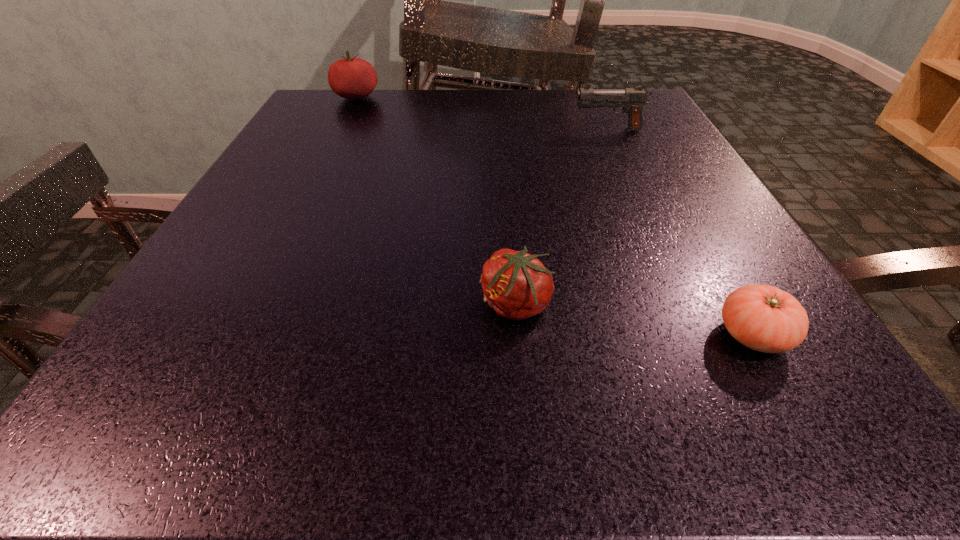
The height and width of the screenshot is (540, 960). Identify the location of vacant point at the far edge. (392, 123).

The image size is (960, 540). In the image, there is a desktop. In order to click on vacant space at the near edge in this screenshot , I will do `click(556, 411)`.

Identify the location of vacant space at the left edge of the desktop. (247, 194).

Identify the location of free space at the right edge. This screenshot has height=540, width=960. (683, 239).

Locate an element on the screen. free space at the far left corner of the desktop is located at coordinates click(x=306, y=116).

Image resolution: width=960 pixels, height=540 pixels. I want to click on free spot at the far right corner of the desktop, so click(646, 107).

I want to click on vacant region between the farthest object and the gun, so click(x=482, y=113).

Locate an element on the screen. This screenshot has height=540, width=960. free space that is in between the leftmost tomato and the second tomato from right to left is located at coordinates (436, 201).

You are a GUI agent. You are given a task and a screenshot of the screen. Output one action in this format:
    pyautogui.click(x=<x>, y=<y>)
    Task: Click on the vacant space that is in between the second object from left to right and the rightmost tomato
    
    Given the screenshot: What is the action you would take?
    pyautogui.click(x=634, y=320)

This screenshot has width=960, height=540. I want to click on free point between the third object from right to left and the third nearest object, so tap(562, 217).